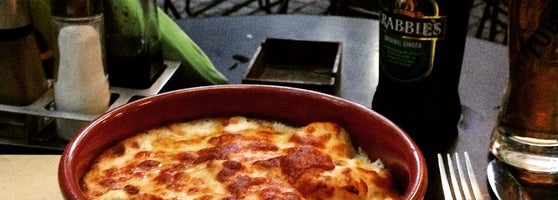
The image size is (558, 200). I want to click on salt shaker, so click(91, 62).